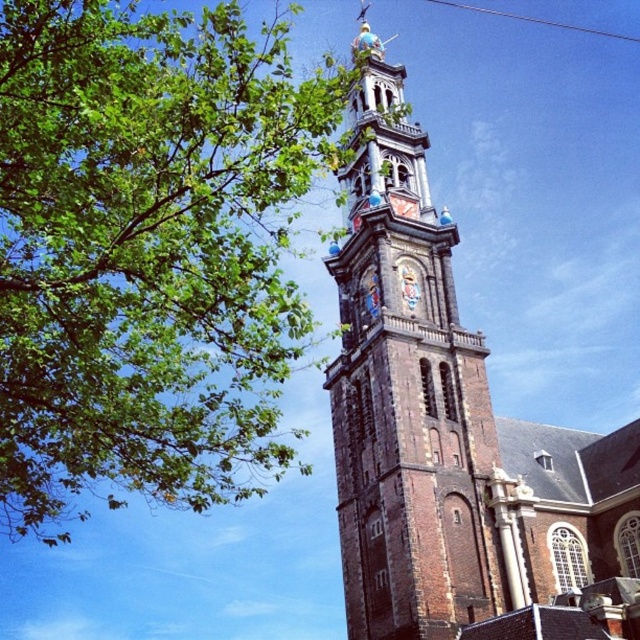
Can you confirm if green leafy tree at upper left is positioned to the right of brown stone tower at center?

In fact, green leafy tree at upper left is to the left of brown stone tower at center.

Is point (132, 310) less distant than point (388, 220)?

Yes, point (132, 310) is in front of point (388, 220).

Is point (147, 476) farther from viewer compared to point (348, 317)?

No.

The width and height of the screenshot is (640, 640). What are the coordinates of `green leafy tree at upper left` in the screenshot? It's located at (148, 250).